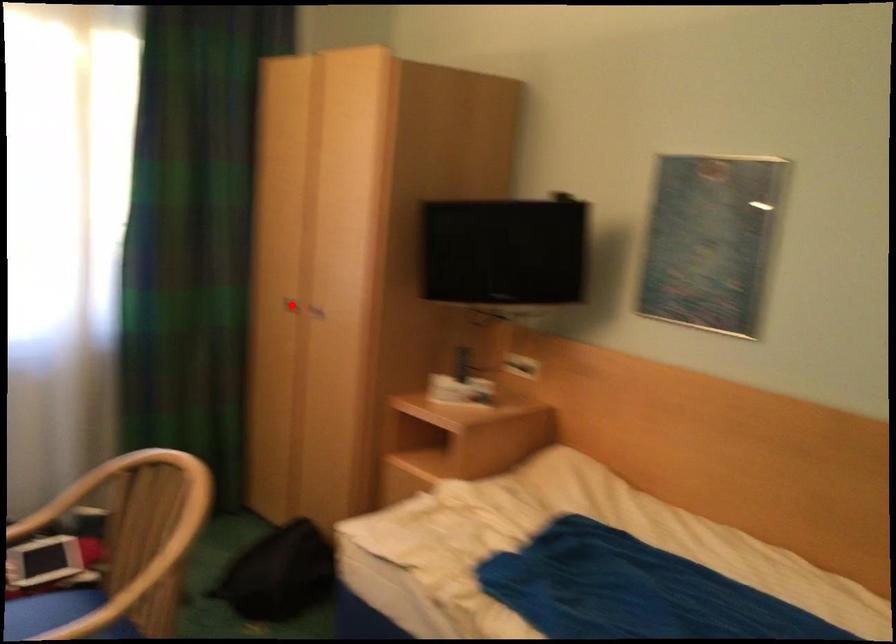
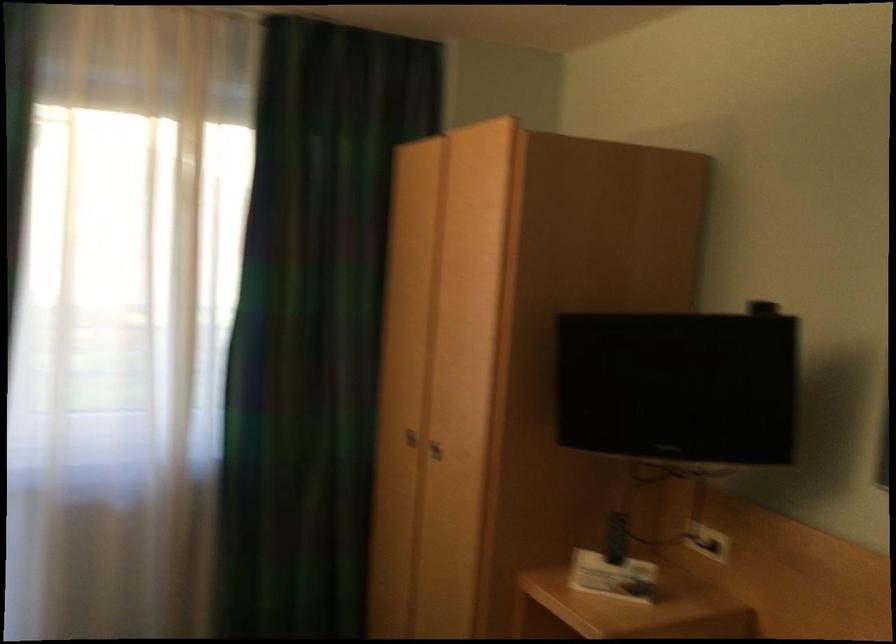
Locate, in the second image, the point that corresponds to the highlighted location in the first image.

(409, 438)